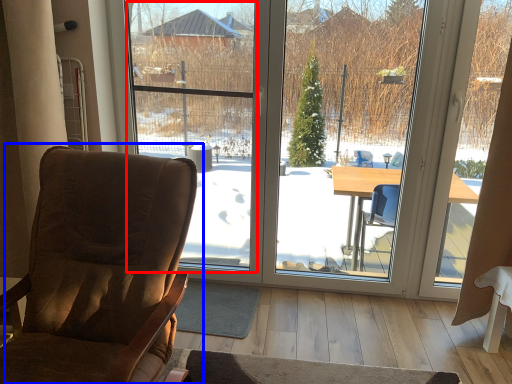
Question: Which object is closer to the camera taking this photo, window screen (highlighted by a red box) or chair (highlighted by a blue box)?

Choices:
 (A) window screen
 (B) chair

Answer: (B)